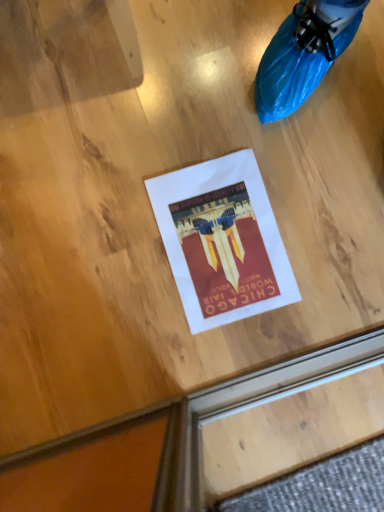
Find the location of a particular element. white paper flyer at center is located at coordinates (222, 241).

This screenshot has width=384, height=512. What do you see at coordinates (222, 241) in the screenshot? I see `white paper flyer at center` at bounding box center [222, 241].

Locate an element on the screen. The width and height of the screenshot is (384, 512). white paper flyer at center is located at coordinates (222, 241).